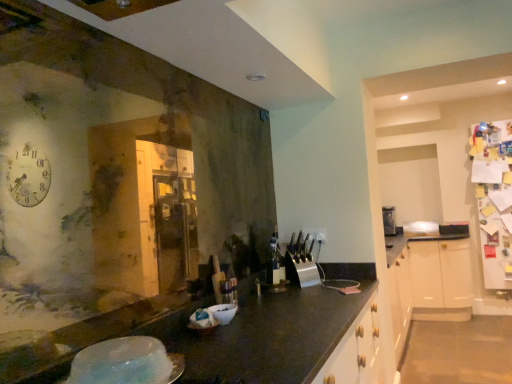
What do you see at coordinates (223, 313) in the screenshot? I see `white glossy bowl at center` at bounding box center [223, 313].

Identify the location of white glossy bowl at center. (223, 313).

What is the approximate width of translucent plastic bowl at lower left?

translucent plastic bowl at lower left is 9.70 inches wide.

Find the location of a particular element. This screenshot has height=384, width=512. translucent plastic bowl at lower left is located at coordinates (126, 363).

The width and height of the screenshot is (512, 384). What do you see at coordinates (126, 363) in the screenshot?
I see `translucent plastic bowl at lower left` at bounding box center [126, 363].

Where is `white glossy bowl at center`? Image resolution: width=512 pixels, height=384 pixels. white glossy bowl at center is located at coordinates click(x=223, y=313).

Would you say translucent plastic bowl at lower left is to the left or to the right of white glossy bowl at center in the picture?

From the image, it's evident that translucent plastic bowl at lower left is to the left of white glossy bowl at center.

Who is more distant, translucent plastic bowl at lower left or white glossy bowl at center?

white glossy bowl at center is more distant.

Considering the positions of points (113, 377) and (228, 311), is point (113, 377) closer to camera compared to point (228, 311)?

Yes, point (113, 377) is closer to viewer.

From the image's perspective, is translucent plastic bowl at lower left above white glossy bowl at center?

Correct, translucent plastic bowl at lower left appears higher than white glossy bowl at center in the image.

From a real-world perspective, does translucent plastic bowl at lower left sit lower than white glossy bowl at center?

Actually, translucent plastic bowl at lower left is physically above white glossy bowl at center in the real world.

Considering the relative sizes of translucent plastic bowl at lower left and white glossy bowl at center in the image provided, is translucent plastic bowl at lower left thinner than white glossy bowl at center?

No, translucent plastic bowl at lower left is not thinner than white glossy bowl at center.

Which of these two, translucent plastic bowl at lower left or white glossy bowl at center, stands taller?

white glossy bowl at center is taller.

Considering the relative sizes of translucent plastic bowl at lower left and white glossy bowl at center in the image provided, is translucent plastic bowl at lower left bigger than white glossy bowl at center?

Indeed, translucent plastic bowl at lower left has a larger size compared to white glossy bowl at center.

Can we say translucent plastic bowl at lower left lies outside white glossy bowl at center?

That's correct, translucent plastic bowl at lower left is outside of white glossy bowl at center.

Is translucent plastic bowl at lower left not near white glossy bowl at center?

No, there isn't a large distance between translucent plastic bowl at lower left and white glossy bowl at center.

Is translucent plastic bowl at lower left aimed at white glossy bowl at center?

No, translucent plastic bowl at lower left does not turn towards white glossy bowl at center.

Can you tell me how much translucent plastic bowl at lower left and white glossy bowl at center differ in facing direction?

There is a 4.16-degree angle between the facing directions of translucent plastic bowl at lower left and white glossy bowl at center.

You are a GUI agent. You are given a task and a screenshot of the screen. Output one action in this format:
    pyautogui.click(x=<x>, y=<y>)
    Task: Click on the appliance lying above the white glossy bowl at center (from the image's perspective)
    The width and height of the screenshot is (512, 384).
    Given the screenshot: What is the action you would take?
    pyautogui.click(x=126, y=363)

Considering the positions of objects white glossy bowl at center and translucent plastic bowl at lower left in the image provided, who is more to the left, white glossy bowl at center or translucent plastic bowl at lower left?

translucent plastic bowl at lower left is more to the left.

Does white glossy bowl at center come behind translucent plastic bowl at lower left?

Yes, it is behind translucent plastic bowl at lower left.

Considering the points (218, 308) and (82, 367), which point is in front, point (218, 308) or point (82, 367)?

The point (82, 367) is more forward.

From the image's perspective, is white glossy bowl at center above or below translucent plastic bowl at lower left?

white glossy bowl at center is below translucent plastic bowl at lower left.

From a real-world perspective, relative to translucent plastic bowl at lower left, is white glossy bowl at center vertically above or below?

white glossy bowl at center is situated lower than translucent plastic bowl at lower left in the real world.

Considering the relative sizes of white glossy bowl at center and translucent plastic bowl at lower left in the image provided, is white glossy bowl at center thinner than translucent plastic bowl at lower left?

Yes, white glossy bowl at center is thinner than translucent plastic bowl at lower left.

Which of these two, white glossy bowl at center or translucent plastic bowl at lower left, stands taller?

white glossy bowl at center is taller.

Which of these two, white glossy bowl at center or translucent plastic bowl at lower left, is smaller?

With smaller size is white glossy bowl at center.

Is white glossy bowl at center situated inside translucent plastic bowl at lower left or outside?

The correct answer is: outside.

Does white glossy bowl at center touch translucent plastic bowl at lower left?

white glossy bowl at center is not next to translucent plastic bowl at lower left, and they're not touching.

Is white glossy bowl at center aimed at translucent plastic bowl at lower left?

No, white glossy bowl at center does not turn towards translucent plastic bowl at lower left.

What's the angular difference between white glossy bowl at center and translucent plastic bowl at lower left's facing directions?

There is a 4.16-degree angle between the facing directions of white glossy bowl at center and translucent plastic bowl at lower left.

You are a GUI agent. You are given a task and a screenshot of the screen. Output one action in this format:
    pyautogui.click(x=<x>, y=<y>)
    Task: Click on the appliance that appears above the white glossy bowl at center (from a real-world perspective)
    Image resolution: width=512 pixels, height=384 pixels.
    Given the screenshot: What is the action you would take?
    pyautogui.click(x=126, y=363)

This screenshot has height=384, width=512. There is a white glossy bowl at center. Find the location of `appliance above it (from a real-world perspective)`. appliance above it (from a real-world perspective) is located at coordinates (126, 363).

Find the location of a particular element. Image resolution: width=512 pixels, height=384 pixels. bowl that appears on the right of translucent plastic bowl at lower left is located at coordinates (223, 313).